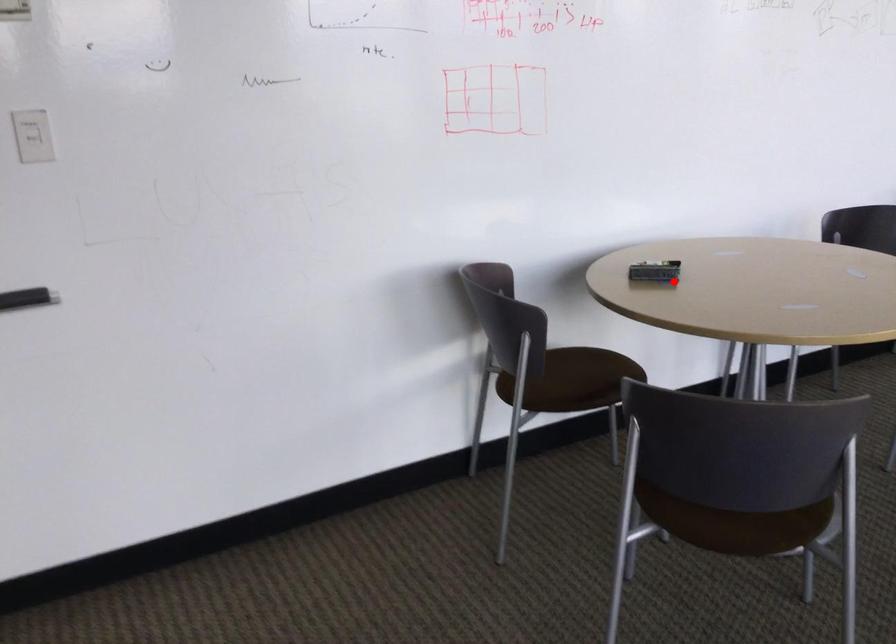
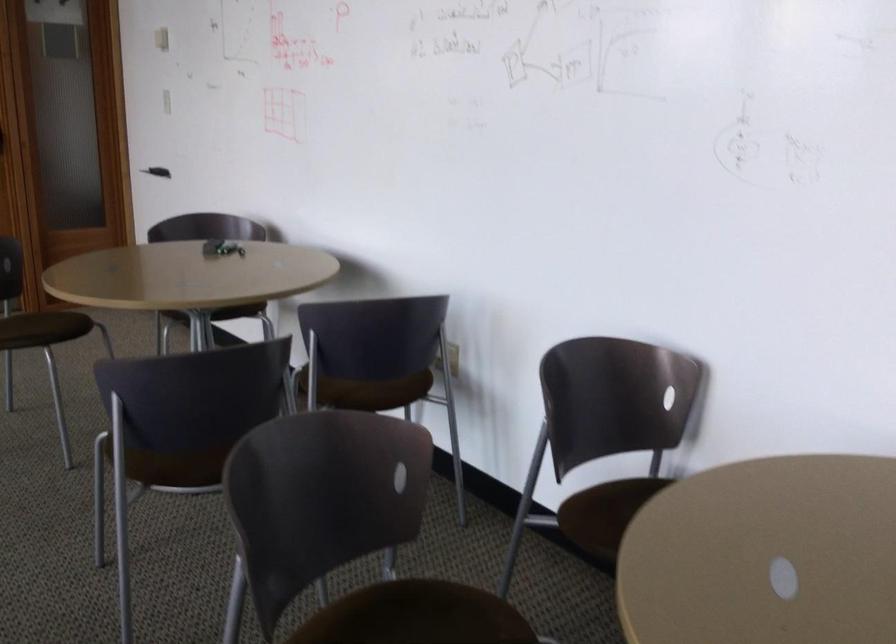
Locate, in the second image, the point that corresponds to the highlighted location in the first image.

(221, 248)